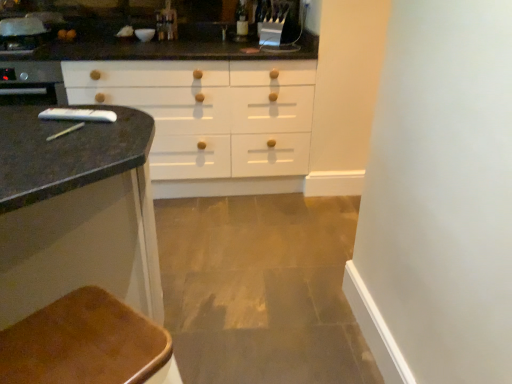
Question: Is metallic faucet at upper center situated inside brown leather chair at lower left or outside?

Choices:
 (A) inside
 (B) outside

Answer: (B)

Question: Is metallic faucet at upper center in front of or behind brown leather chair at lower left in the image?

Choices:
 (A) behind
 (B) front

Answer: (A)

Question: Is metallic faucet at upper center wider or thinner than brown leather chair at lower left?

Choices:
 (A) thin
 (B) wide

Answer: (A)

Question: From a real-world perspective, is brown leather chair at lower left physically located above or below metallic faucet at upper center?

Choices:
 (A) above
 (B) below

Answer: (B)

Question: From the image's perspective, is brown leather chair at lower left located above or below metallic faucet at upper center?

Choices:
 (A) below
 (B) above

Answer: (A)

Question: Is brown leather chair at lower left bigger or smaller than metallic faucet at upper center?

Choices:
 (A) small
 (B) big

Answer: (B)

Question: In the image, is brown leather chair at lower left on the left side or the right side of metallic faucet at upper center?

Choices:
 (A) right
 (B) left

Answer: (A)